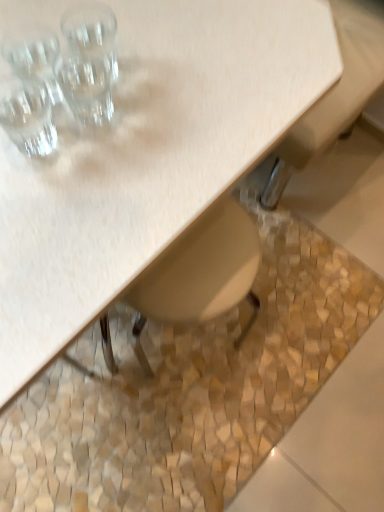
Find the location of a particular element. free location to the right of transparent glass at upper left, the 2th shot glass when ordered from top to bottom is located at coordinates (198, 102).